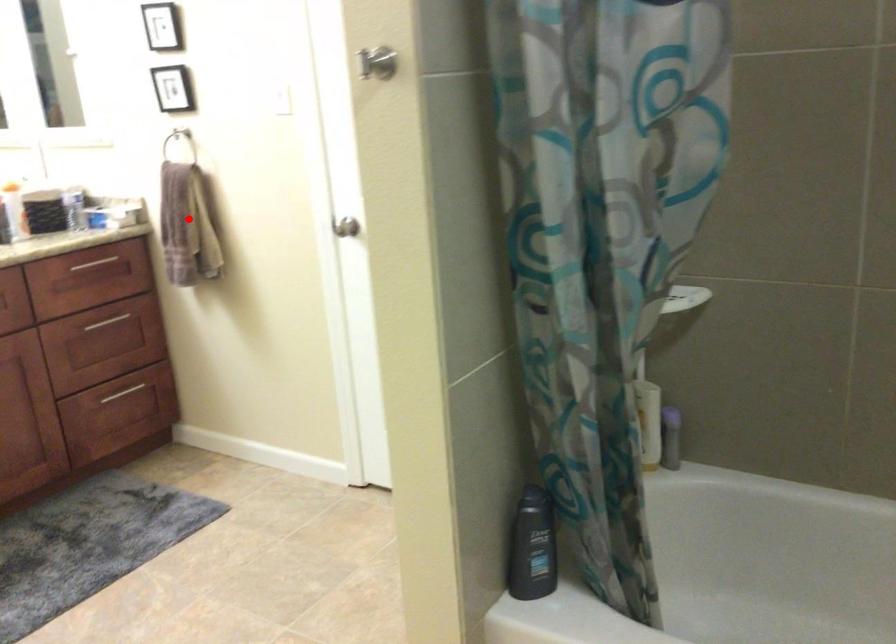
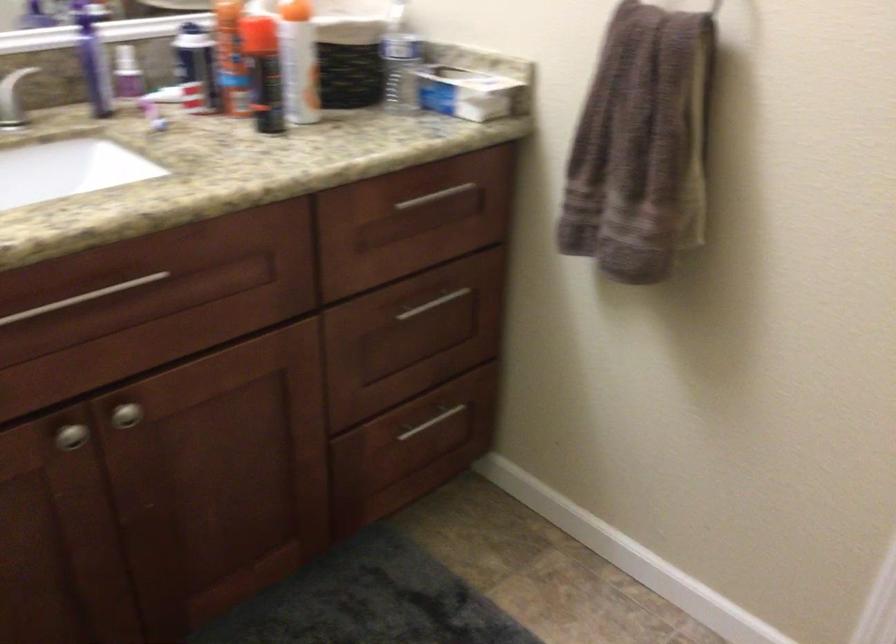
Question: I am providing you with two images of the same scene from different viewpoints. A red point is shown in image1. For the corresponding object point in image2, is it positioned nearer or farther from the camera?

Choices:
 (A) Nearer
 (B) Farther

Answer: (A)